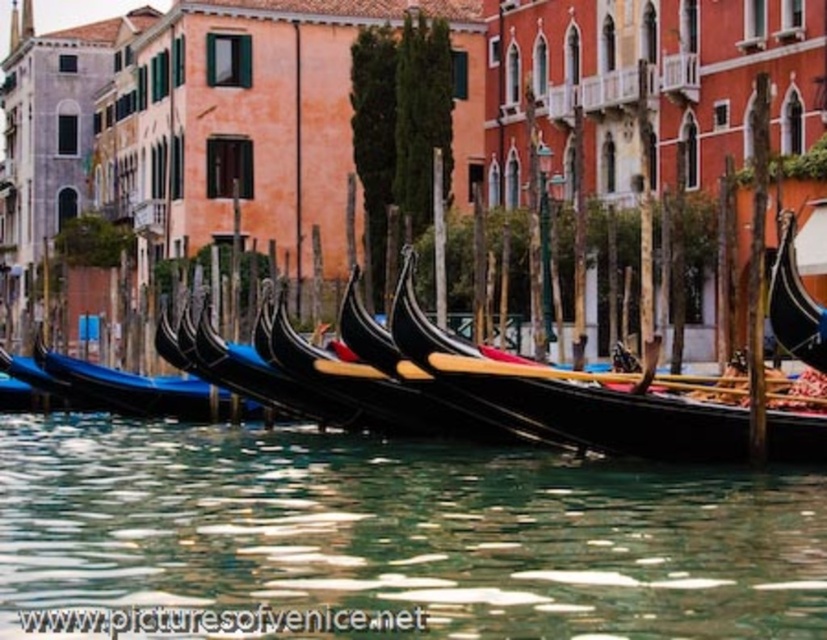
You are a tourist standing on the canal bridge and want to take a photo of the black polished wood gondola at center and the shiny black gondola at left. Which gondola will appear taller in your photo?

The black polished wood gondola at center will appear taller in the photo because it is taller than the shiny black gondola at left.

Consider the image. You are a tourist standing on the canal bridge and want to take a photo of the transparent glass water at center and the black polished wood gondola at center. Which object would appear wider in the photo?

The transparent glass water at center might appear wider than the black polished wood gondola at center according to the description.